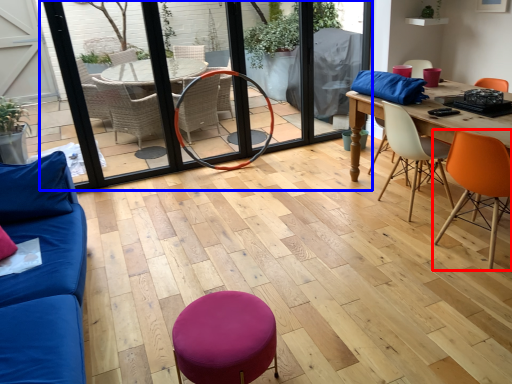
Question: Among these objects, which one is farthest to the camera, chair (highlighted by a red box) or screen door (highlighted by a blue box)?

Choices:
 (A) chair
 (B) screen door

Answer: (B)